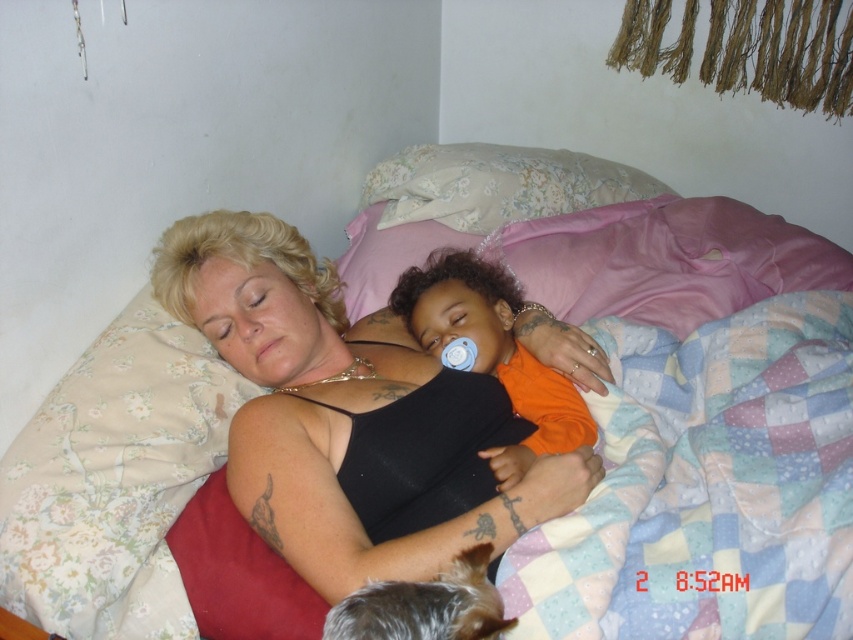
From the picture: Does shiny brown fur at lower center have a larger size compared to blue rubber teething ring at center?

Indeed, shiny brown fur at lower center has a larger size compared to blue rubber teething ring at center.

Is shiny brown fur at lower center thinner than blue rubber teething ring at center?

Incorrect, shiny brown fur at lower center's width is not less than blue rubber teething ring at center's.

Locate an element on the screen. Image resolution: width=853 pixels, height=640 pixels. shiny brown fur at lower center is located at coordinates (425, 605).

Between floral fabric pillow at upper center and shiny brown fur at lower center, which one appears on the right side from the viewer's perspective?

From the viewer's perspective, floral fabric pillow at upper center appears more on the right side.

Is floral fabric pillow at upper center further to camera compared to shiny brown fur at lower center?

Yes.

I want to click on floral fabric pillow at upper center, so click(497, 184).

Image resolution: width=853 pixels, height=640 pixels. Find the location of `floral fabric pillow at upper center`. floral fabric pillow at upper center is located at coordinates (497, 184).

Does floral fabric pillow at upper center have a lesser height compared to orange matte shirt at center?

Indeed, floral fabric pillow at upper center has a lesser height compared to orange matte shirt at center.

From the picture: Does floral fabric pillow at upper center have a greater width compared to orange matte shirt at center?

Yes.

Where is `floral fabric pillow at upper center`? The width and height of the screenshot is (853, 640). floral fabric pillow at upper center is located at coordinates (497, 184).